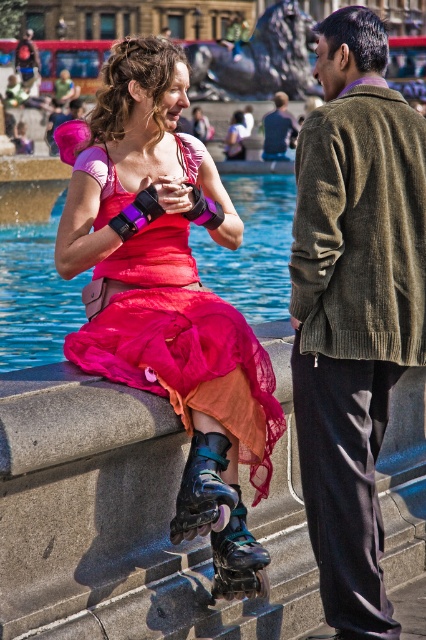
Is matte pink dress at center to the left of shiny blue roller skates at lower center from the viewer's perspective?

Yes, matte pink dress at center is to the left of shiny blue roller skates at lower center.

Is matte pink dress at center closer to the viewer compared to shiny blue roller skates at lower center?

No, it is behind shiny blue roller skates at lower center.

The height and width of the screenshot is (640, 426). What do you see at coordinates (166, 282) in the screenshot?
I see `matte pink dress at center` at bounding box center [166, 282].

This screenshot has height=640, width=426. Find the location of `matte pink dress at center`. matte pink dress at center is located at coordinates (166, 282).

Measure the distance from green corduroy jacket at right to matte black jacket at center.

green corduroy jacket at right is 100.98 meters away from matte black jacket at center.

Is green corduroy jacket at right thinner than matte black jacket at center?

Correct, green corduroy jacket at right's width is less than matte black jacket at center's.

Is point (340, 470) positioned in front of point (275, 102)?

Yes, it is.

Find the location of a particular element. green corduroy jacket at right is located at coordinates (354, 307).

Does matte pink dress at center appear under shiny black roller skates at center?

Actually, matte pink dress at center is above shiny black roller skates at center.

Does matte pink dress at center appear over shiny black roller skates at center?

Correct, matte pink dress at center is located above shiny black roller skates at center.

Is point (244, 417) positioned behind point (253, 580)?

Yes, point (244, 417) is behind point (253, 580).

You are a GUI agent. You are given a task and a screenshot of the screen. Output one action in this format:
    pyautogui.click(x=<x>, y=<y>)
    Task: Click on the matte pink dress at center
    This screenshot has height=640, width=426.
    Given the screenshot: What is the action you would take?
    pyautogui.click(x=166, y=282)